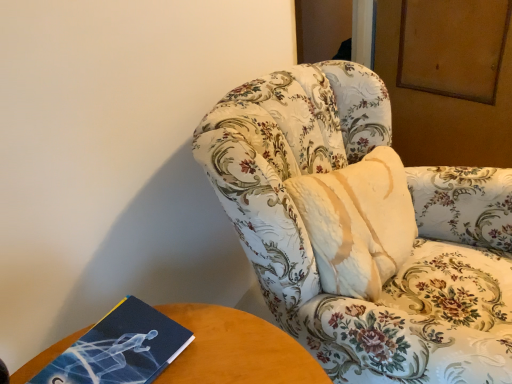
You are a GUI agent. You are given a task and a screenshot of the screen. Output one action in this format:
    pyautogui.click(x=<x>, y=<y>)
    Task: Click on the blue matte book at lower left
    The width and height of the screenshot is (512, 384).
    Given the screenshot: What is the action you would take?
    pyautogui.click(x=120, y=348)

What do you see at coordinates (120, 348) in the screenshot? Image resolution: width=512 pixels, height=384 pixels. I see `blue matte book at lower left` at bounding box center [120, 348].

Find the location of a particular element. This screenshot has width=512, height=384. floral-patterned fabric chair at center is located at coordinates (362, 231).

The image size is (512, 384). Describe the element at coordinates (362, 231) in the screenshot. I see `floral-patterned fabric chair at center` at that location.

Measure the distance between point (467, 169) and camera.

3.88 feet.

Locate an element on the screen. blue matte book at lower left is located at coordinates (120, 348).

Does floral-patterned fabric chair at center appear on the right side of blue matte book at lower left?

Indeed, floral-patterned fabric chair at center is positioned on the right side of blue matte book at lower left.

Relative to blue matte book at lower left, is floral-patterned fabric chair at center in front or behind?

floral-patterned fabric chair at center is in front of blue matte book at lower left.

Considering the positions of points (370, 309) and (50, 376), is point (370, 309) farther from camera compared to point (50, 376)?

Yes, it is behind point (50, 376).

Looking at this image, from the image's perspective, does floral-patterned fabric chair at center appear lower than blue matte book at lower left?

No.

From a real-world perspective, is floral-patterned fabric chair at center physically located above or below blue matte book at lower left?

floral-patterned fabric chair at center is below blue matte book at lower left.

In terms of width, does floral-patterned fabric chair at center look wider or thinner when compared to blue matte book at lower left?

floral-patterned fabric chair at center is wider than blue matte book at lower left.

Which of these two, floral-patterned fabric chair at center or blue matte book at lower left, stands shorter?

With less height is blue matte book at lower left.

Which of these two, floral-patterned fabric chair at center or blue matte book at lower left, is smaller?

Smaller between the two is blue matte book at lower left.

Is floral-patterned fabric chair at center located outside blue matte book at lower left?

That's correct, floral-patterned fabric chair at center is outside of blue matte book at lower left.

Is there a large distance between floral-patterned fabric chair at center and blue matte book at lower left?

Actually, floral-patterned fabric chair at center and blue matte book at lower left are a little close together.

Is floral-patterned fabric chair at center looking in the opposite direction of blue matte book at lower left?

That's not correct — floral-patterned fabric chair at center is not looking away from blue matte book at lower left.

How far apart are floral-patterned fabric chair at center and blue matte book at lower left?

They are 49.12 centimeters apart.

Image resolution: width=512 pixels, height=384 pixels. There is a floral-patterned fabric chair at center. Find the location of `paperback book above it (from a real-world perspective)`. paperback book above it (from a real-world perspective) is located at coordinates click(120, 348).

Between blue matte book at lower left and floral-patterned fabric chair at center, which one appears on the right side from the viewer's perspective?

floral-patterned fabric chair at center.

Which object is further away from the camera, blue matte book at lower left or floral-patterned fabric chair at center?

blue matte book at lower left is more distant.

Which is in front, point (151, 354) or point (504, 298)?

The point (151, 354) is in front.

From the image's perspective, does blue matte book at lower left appear lower than floral-patterned fabric chair at center?

Indeed, from the image's perspective, blue matte book at lower left is shown beneath floral-patterned fabric chair at center.

From a real-world perspective, is blue matte book at lower left physically below floral-patterned fabric chair at center?

No.

Looking at their sizes, would you say blue matte book at lower left is wider or thinner than floral-patterned fabric chair at center?

Clearly, blue matte book at lower left has less width compared to floral-patterned fabric chair at center.

Considering the sizes of objects blue matte book at lower left and floral-patterned fabric chair at center in the image provided, who is shorter, blue matte book at lower left or floral-patterned fabric chair at center?

blue matte book at lower left.

Between blue matte book at lower left and floral-patterned fabric chair at center, which one has smaller size?

blue matte book at lower left.

Is blue matte book at lower left not within floral-patterned fabric chair at center?

Yes, blue matte book at lower left is not within floral-patterned fabric chair at center.

Is blue matte book at lower left positioned far away from floral-patterned fabric chair at center?

They are positioned close to each other.

Could you tell me if blue matte book at lower left is facing floral-patterned fabric chair at center?

No, blue matte book at lower left is not turned towards floral-patterned fabric chair at center.

Consider the image. What's the angular difference between blue matte book at lower left and floral-patterned fabric chair at center's facing directions?

The facing directions of blue matte book at lower left and floral-patterned fabric chair at center are 4.6 degrees apart.

Identify the location of chair in front of the blue matte book at lower left. (362, 231).

Where is `chair to the right of blue matte book at lower left`? chair to the right of blue matte book at lower left is located at coordinates (362, 231).

This screenshot has height=384, width=512. I want to click on paperback book behind the floral-patterned fabric chair at center, so click(x=120, y=348).